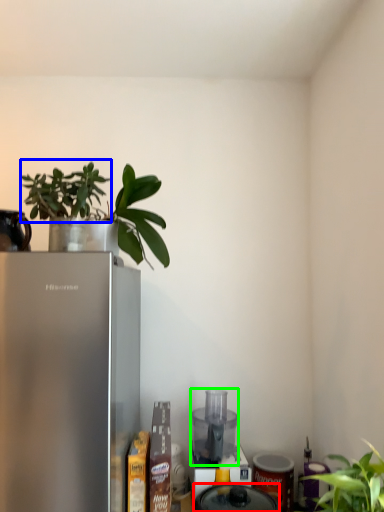
Question: Which object is positioned closest to appliance (highlighted by a red box)? Select from plant (highlighted by a blue box) and appliance (highlighted by a green box).

Choices:
 (A) plant
 (B) appliance

Answer: (B)